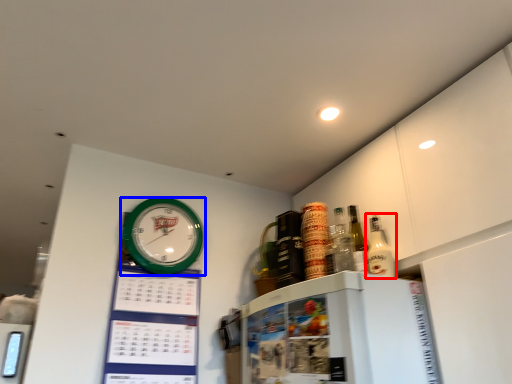
Question: Which object is further to the camera taking this photo, bottle (highlighted by a red box) or wall clock (highlighted by a blue box)?

Choices:
 (A) bottle
 (B) wall clock

Answer: (B)